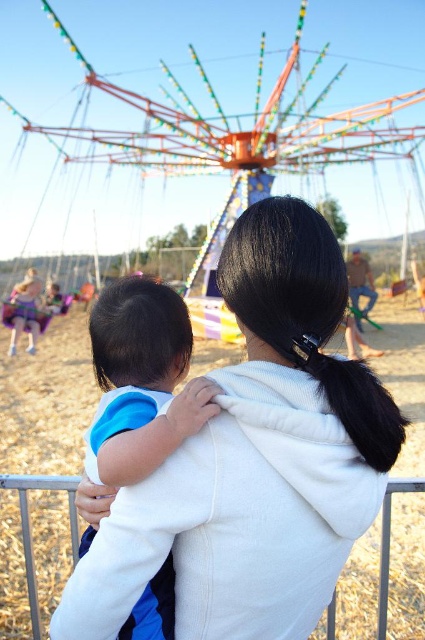
Question: Is white fleece jacket at center in front of multicolored plastic carousel at center?

Choices:
 (A) yes
 (B) no

Answer: (A)

Question: Which of these objects is positioned farthest from the multicolored plastic carousel at center?

Choices:
 (A) white fleece jacket at center
 (B) white fabric at center

Answer: (B)

Question: Considering the real-world distances, which object is farthest from the multicolored plastic carousel at center?

Choices:
 (A) white fabric at center
 (B) white fleece jacket at center

Answer: (A)

Question: Estimate the real-world distances between objects in this image. Which object is farther from the white fleece jacket at center?

Choices:
 (A) multicolored plastic carousel at center
 (B) blue cotton shirt at center

Answer: (A)

Question: Can you confirm if multicolored plastic carousel at center is bigger than blue cotton shirt at center?

Choices:
 (A) no
 (B) yes

Answer: (B)

Question: Can you confirm if blue cotton shirt at center is positioned to the right of white fabric at center?

Choices:
 (A) yes
 (B) no

Answer: (B)